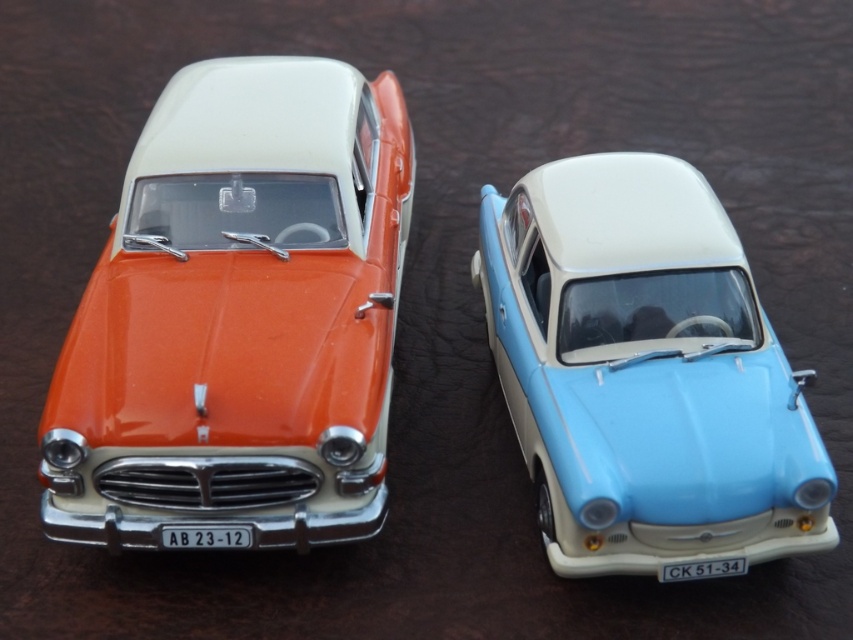
You are a collector of vintage cars and are examining two miniature models on a display. You notice the orange glossy car at left and the light blue plastic car at center. Which car appears closer to you when looking at the display?

The orange glossy car at left appears closer to you because it is positioned further to the viewer than the light blue plastic car at center.

You are a toy organizer arranging miniature cars on a shelf. You have two cars in front of you, the orange glossy car at left and the light blue plastic car at center. Which car requires a wider space on the shelf to accommodate its size?

The orange glossy car at left requires a wider space on the shelf because its width surpasses that of the light blue plastic car at center.